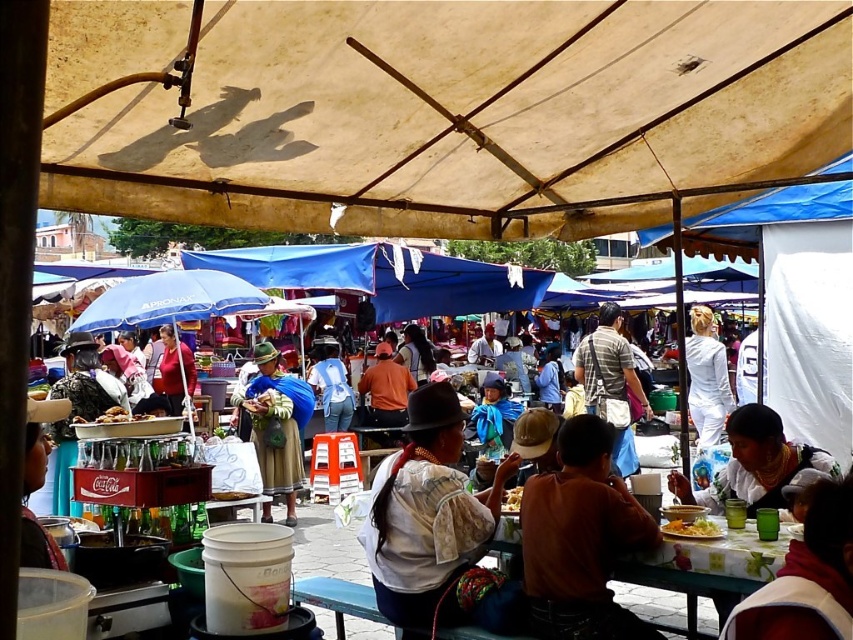
Between white cotton blouse at center and blue woven skirt at center, which one has more height?

blue woven skirt at center

Does white cotton blouse at center come in front of blue woven skirt at center?

Yes, it is in front of blue woven skirt at center.

Looking at this image, who is more distant from viewer, (x=427, y=416) or (x=309, y=413)?

Positioned behind is point (x=309, y=413).

Locate an element on the screen. white cotton blouse at center is located at coordinates (428, 515).

Looking at this image, does beige canvas canopy at upper center appear on the left side of golden brown bread at center?

No, beige canvas canopy at upper center is not to the left of golden brown bread at center.

Is point (254, 116) in front of point (138, 412)?

Yes, point (254, 116) is closer to viewer.

Find the location of a particular element. The width and height of the screenshot is (853, 640). beige canvas canopy at upper center is located at coordinates (438, 112).

Between white floral tablecloth at center and golden brown bread at center, which one is positioned higher?

Positioned higher is golden brown bread at center.

Is white floral tablecloth at center shorter than golden brown bread at center?

No.

Is point (613, 577) farther from camera compared to point (120, 413)?

That is False.

The height and width of the screenshot is (640, 853). I want to click on white floral tablecloth at center, so click(705, 566).